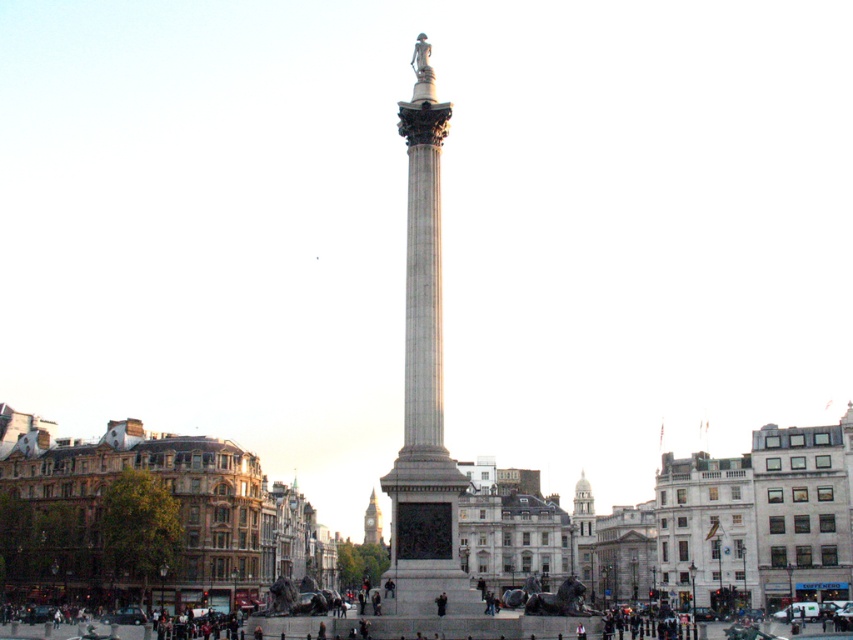
Question: Does smooth stone monument at center appear on the right side of smooth stone column at center?

Choices:
 (A) no
 (B) yes

Answer: (A)

Question: Observing the image, what is the correct spatial positioning of smooth stone column at center in reference to golden stone clock tower at center?

Choices:
 (A) left
 (B) right

Answer: (B)

Question: Observing the image, what is the correct spatial positioning of smooth stone column at center in reference to golden stone clock tower at center?

Choices:
 (A) right
 (B) left

Answer: (A)

Question: Which point is farther from the camera taking this photo?

Choices:
 (A) (405, 305)
 (B) (372, 524)
 (C) (523, 560)

Answer: (B)

Question: Estimate the real-world distances between objects in this image. Which object is closer to the smooth stone monument at center?

Choices:
 (A) smooth stone column at center
 (B) white stone tower at center

Answer: (A)

Question: Which of the following is the closest to the observer?

Choices:
 (A) smooth stone column at center
 (B) smooth stone monument at center

Answer: (A)